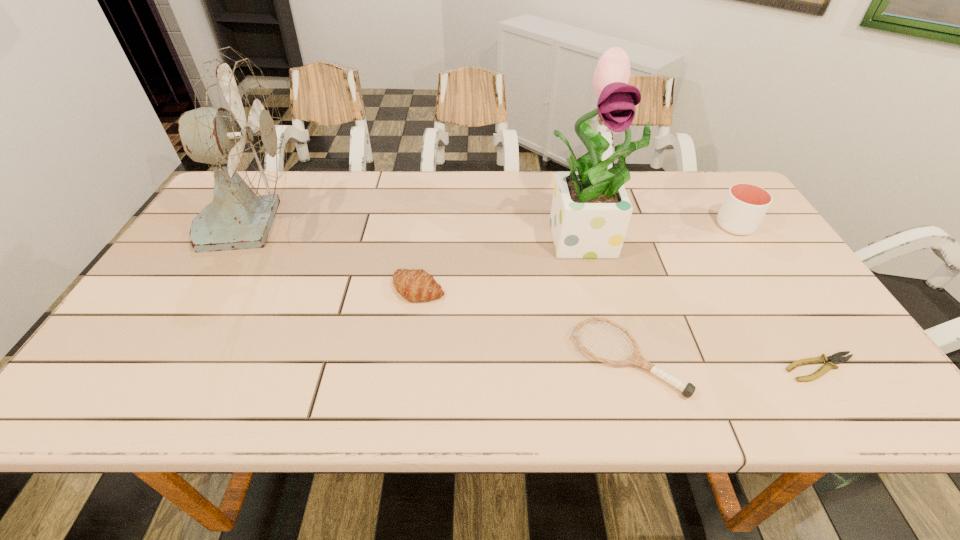
Where is `unoccupied position between the cup and the shortest object`? unoccupied position between the cup and the shortest object is located at coordinates (779, 296).

Image resolution: width=960 pixels, height=540 pixels. I want to click on free spot between the leftmost object and the third tallest object, so click(493, 224).

Locate an element on the screen. unoccupied position between the cup and the pliers is located at coordinates (779, 296).

Image resolution: width=960 pixels, height=540 pixels. I want to click on free space between the cup and the fan, so click(493, 224).

Where is `empty space that is in between the fourth tallest object and the fan`? Image resolution: width=960 pixels, height=540 pixels. empty space that is in between the fourth tallest object and the fan is located at coordinates (335, 255).

Image resolution: width=960 pixels, height=540 pixels. What are the coordinates of `free space between the fourth shortest object and the flower arrangement` in the screenshot? It's located at (661, 231).

Where is `object that stands as the second closest to the third nearest object`? This screenshot has width=960, height=540. object that stands as the second closest to the third nearest object is located at coordinates (635, 358).

Select which object is the third closest to the fan. Please provide its 2D coordinates. Your answer should be formatted as a tuple, i.e. [(x, y)], where the tuple contains the x and y coordinates of a point satisfying the conditions above.

[(635, 358)]

Locate an element on the screen. This screenshot has height=540, width=960. vacant region that satisfies the following two spatial constraints: 1. on the front-facing side of the flower arrangement; 2. on the right side of the pliers is located at coordinates (624, 368).

Find the location of a particular element. The width and height of the screenshot is (960, 540). vacant point that satisfies the following two spatial constraints: 1. on the front-facing side of the tennis racket; 2. on the right side of the flower arrangement is located at coordinates (621, 358).